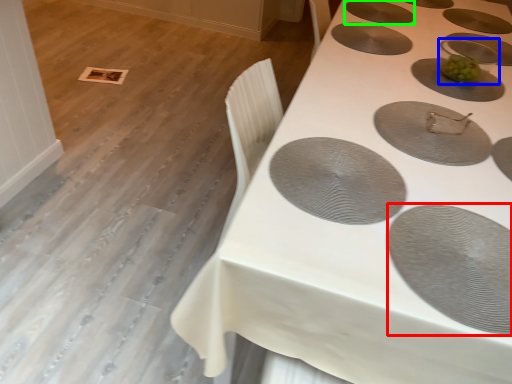
Question: Considering the real-world distances, which object is closest to oval (highlighted by a red box)? appliance (highlighted by a blue box) or oval (highlighted by a green box).

Choices:
 (A) appliance
 (B) oval

Answer: (A)